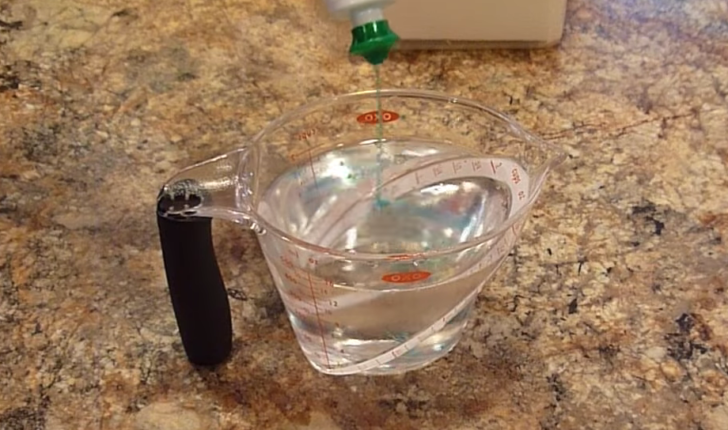
Show me where where i'd grab the measuring cup are located in the image. Your answer should be formatted as a list of tuples, i.e. [(x1, y1), (x2, y2), ...], where each tuple contains the x and y coordinates of a point satisfying the conditions above.

[(201, 272)]